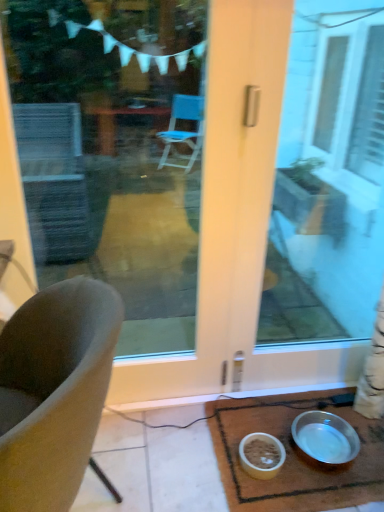
The width and height of the screenshot is (384, 512). In order to click on free area behind matte brown bowl at lower center, arranged as the second bowl when viewed from the right in this screenshot , I will do `click(249, 418)`.